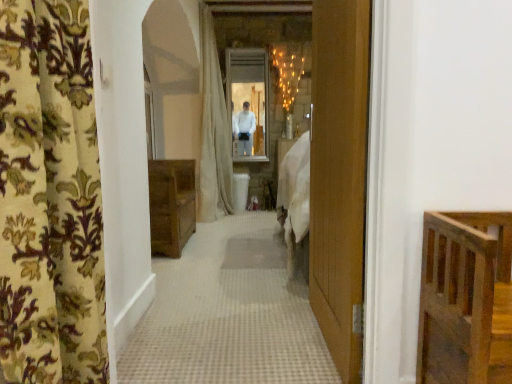
Question: Is beige fabric shower curtain at center bigger or smaller than white glossy mirror at center?

Choices:
 (A) small
 (B) big

Answer: (B)

Question: Is beige fabric shower curtain at center wider or thinner than white glossy mirror at center?

Choices:
 (A) wide
 (B) thin

Answer: (A)

Question: Which of these objects is positioned closest to the floral-patterned fabric at left?

Choices:
 (A) white glossy mirror at center
 (B) beige fabric shower curtain at center

Answer: (B)

Question: Which is nearer to the floral-patterned fabric at left?

Choices:
 (A) white glossy mirror at center
 (B) beige fabric shower curtain at center

Answer: (B)